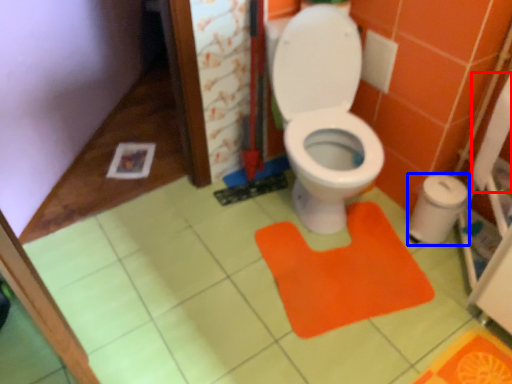
Question: Which of the following is the closest to the observer, toilet paper (highlighted by a red box) or potty (highlighted by a blue box)?

Choices:
 (A) toilet paper
 (B) potty

Answer: (A)